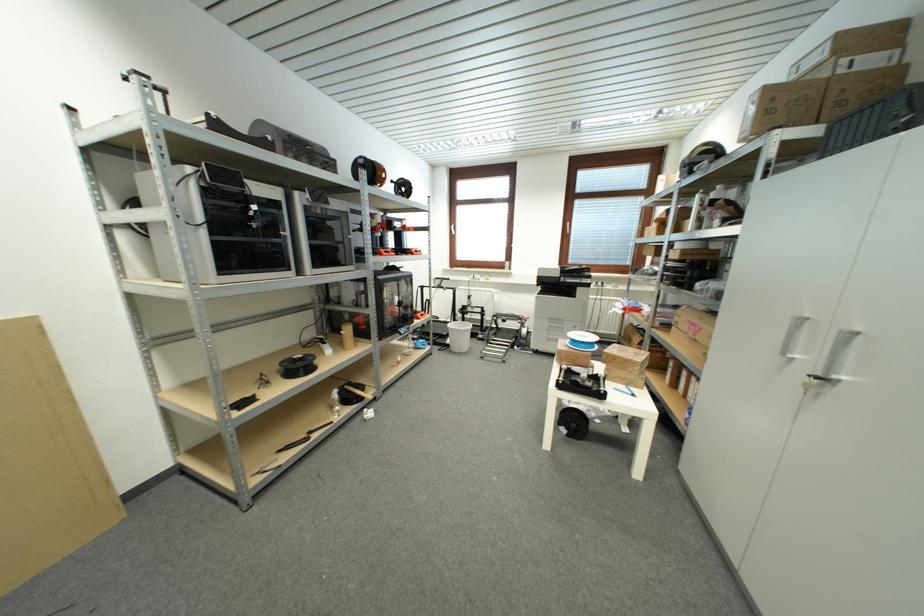
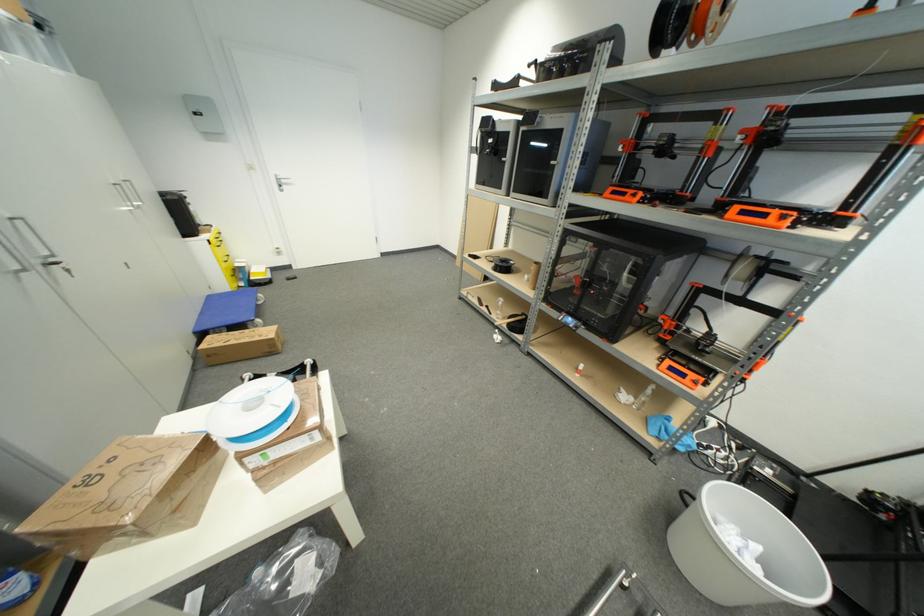
Where in the second image is the point corresponding to the point at 426,318 from the first image?

(675, 371)